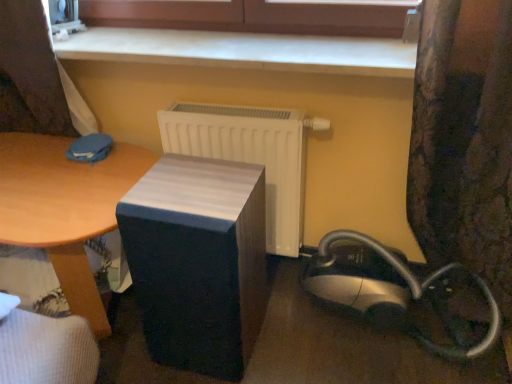
Question: Is smooth wood surface at upper center in front of or behind silver/black plastic vacuum cleaner at lower right in the image?

Choices:
 (A) front
 (B) behind

Answer: (B)

Question: Is point (362, 16) closer or farther from the camera than point (324, 263)?

Choices:
 (A) closer
 (B) farther

Answer: (A)

Question: Which object is positioned closest to the smooth wood surface at upper center?

Choices:
 (A) smooth white surface at upper center
 (B) white matte radiator at center
 (C) matte black speaker at center
 (D) wooden table at center
 (E) silver/black plastic vacuum cleaner at lower right

Answer: (A)

Question: Which of these objects is positioned farthest from the smooth wood surface at upper center?

Choices:
 (A) smooth white surface at upper center
 (B) floral fabric curtain at right
 (C) silver/black plastic vacuum cleaner at lower right
 (D) matte black speaker at center
 (E) wooden table at center

Answer: (C)